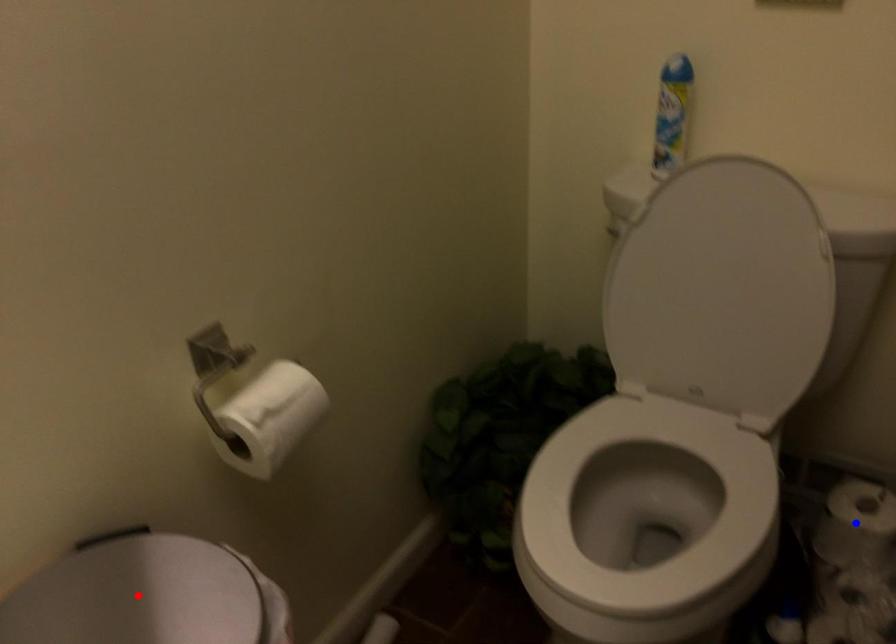
Question: Two points are marked on the image. Which point is closer to the camera?

Choices:
 (A) Blue point is closer.
 (B) Red point is closer.

Answer: (B)